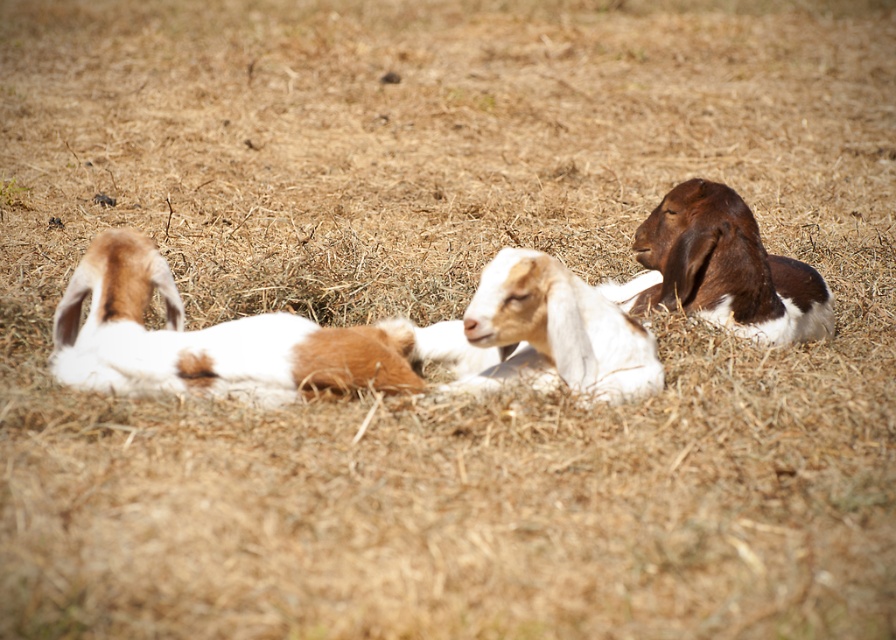
Describe the element at coordinates (727, 268) in the screenshot. Image resolution: width=896 pixels, height=640 pixels. I see `brown and white fur at right` at that location.

Is brown and white fur at right wider than white woolen goat at center?

Correct, the width of brown and white fur at right exceeds that of white woolen goat at center.

The image size is (896, 640). What do you see at coordinates (727, 268) in the screenshot?
I see `brown and white fur at right` at bounding box center [727, 268].

The height and width of the screenshot is (640, 896). Identify the location of brown and white fur at right. (727, 268).

Can you confirm if brown and white fur goat at left is taller than brown and white fur at right?

No.

I want to click on brown and white fur goat at left, so click(207, 339).

The height and width of the screenshot is (640, 896). Find the location of `brown and white fur goat at left`. brown and white fur goat at left is located at coordinates (207, 339).

Does brown and white fur goat at left come in front of white woolen goat at center?

No.

In the scene shown: Can you confirm if brown and white fur goat at left is shorter than white woolen goat at center?

No.

The height and width of the screenshot is (640, 896). I want to click on brown and white fur goat at left, so (x=207, y=339).